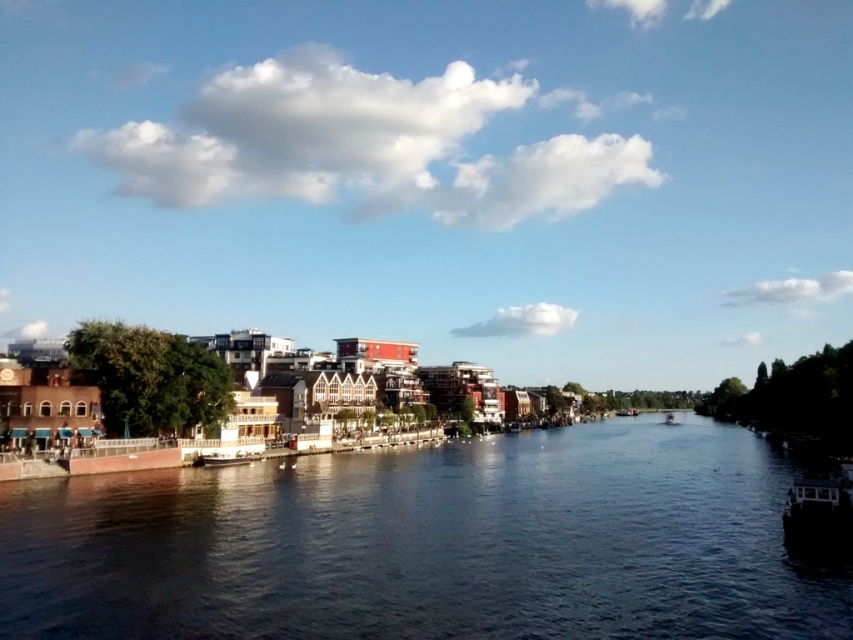
Who is higher up, metallic silver boat at lower right or white plastic boat at center?

metallic silver boat at lower right is higher up.

Locate an element on the screen. This screenshot has width=853, height=640. metallic silver boat at lower right is located at coordinates (819, 513).

Is point (582, 586) farther from camera compared to point (668, 422)?

No, (582, 586) is closer to viewer.

Can you confirm if dark blue water at center is positioned below white plastic boat at center?

No, dark blue water at center is not below white plastic boat at center.

Does point (376, 600) come farther from viewer compared to point (674, 422)?

That is False.

I want to click on dark blue water at center, so click(x=428, y=545).

What do you see at coordinates (428, 545) in the screenshot? I see `dark blue water at center` at bounding box center [428, 545].

The image size is (853, 640). Describe the element at coordinates (428, 545) in the screenshot. I see `dark blue water at center` at that location.

I want to click on dark blue water at center, so click(428, 545).